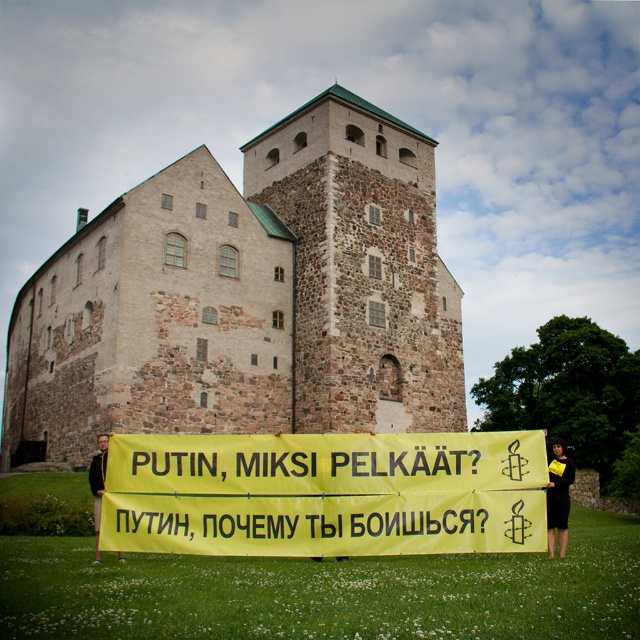
The width and height of the screenshot is (640, 640). Describe the element at coordinates (324, 493) in the screenshot. I see `yellow/yellow paper at center` at that location.

Is point (164, 460) in front of point (548, 468)?

That is True.

You are a GUI agent. You are given a task and a screenshot of the screen. Output one action in this format:
    pyautogui.click(x=<x>, y=<y>)
    Task: Click on the yellow/yellow paper at center
    
    Given the screenshot: What is the action you would take?
    pyautogui.click(x=324, y=493)

Does black fabric at lower right have a lesser width compared to dark brown leather jacket at center?

Indeed, black fabric at lower right has a lesser width compared to dark brown leather jacket at center.

Looking at this image, is black fabric at lower right closer to the viewer compared to dark brown leather jacket at center?

No, it is behind dark brown leather jacket at center.

What do you see at coordinates (557, 496) in the screenshot? I see `black fabric at lower right` at bounding box center [557, 496].

Locate an element on the screen. The image size is (640, 640). black fabric at lower right is located at coordinates (557, 496).

Can you confirm if stone brick castle at center is wider than black fabric at lower right?

Indeed, stone brick castle at center has a greater width compared to black fabric at lower right.

The image size is (640, 640). In order to click on stone brick castle at center in this screenshot , I will do `click(248, 298)`.